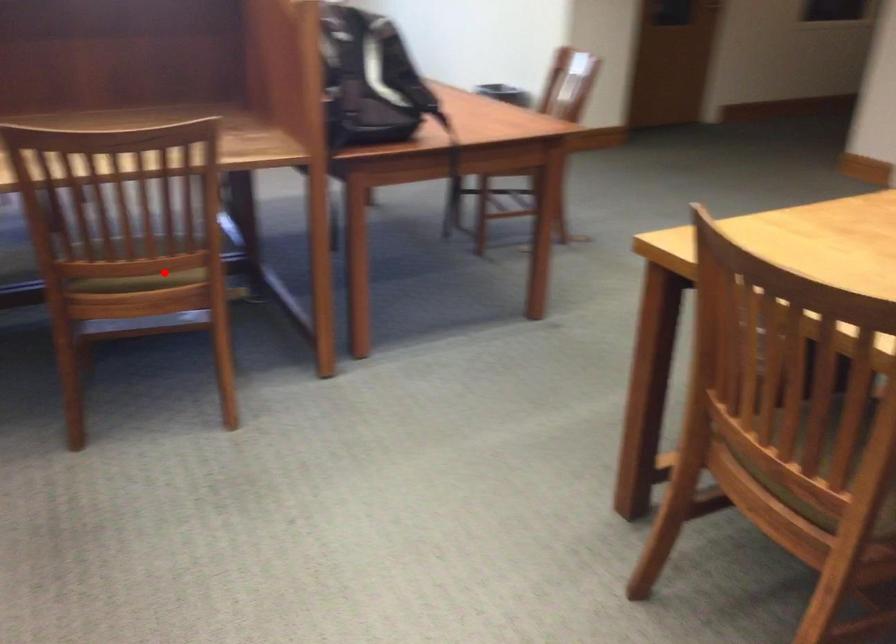
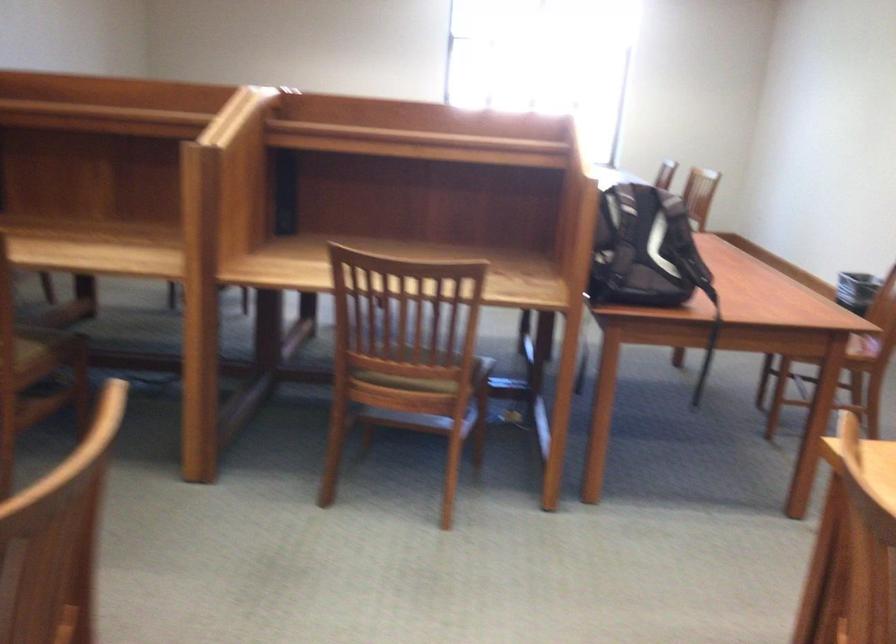
Question: I am providing you with two images of the same scene from different viewpoints. Given a red point in image1, look at the same physical point in image2. Is it:

Choices:
 (A) Closer to the viewpoint
 (B) Farther from the viewpoint

Answer: (B)